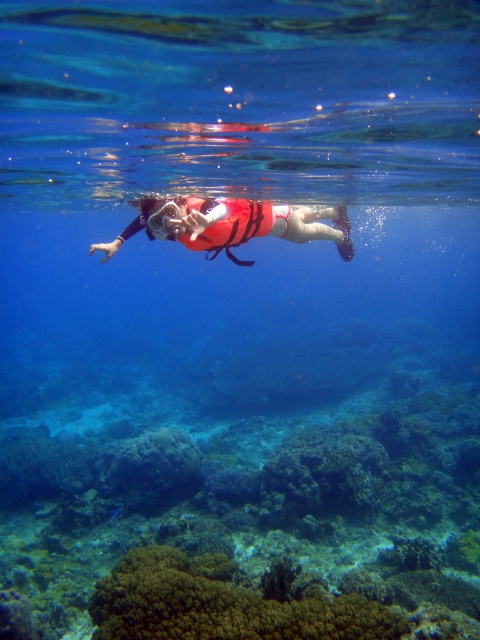
Question: Among these points, which one is nearest to the camera?

Choices:
 (A) (211, 198)
 (B) (186, 592)
 (C) (388, 486)

Answer: (B)

Question: Does brown textured coral at lower center have a larger size compared to red life vest at center?

Choices:
 (A) yes
 (B) no

Answer: (B)

Question: Does green textured coral reef at center have a larger size compared to red life vest at center?

Choices:
 (A) yes
 (B) no

Answer: (A)

Question: Which object is positioned farthest from the green textured coral reef at center?

Choices:
 (A) red life vest at center
 (B) brown textured coral at lower center

Answer: (A)

Question: Is green textured coral reef at center bigger than red life vest at center?

Choices:
 (A) no
 (B) yes

Answer: (B)

Question: Which object appears closest to the camera in this image?

Choices:
 (A) red life vest at center
 (B) green textured coral reef at center

Answer: (B)